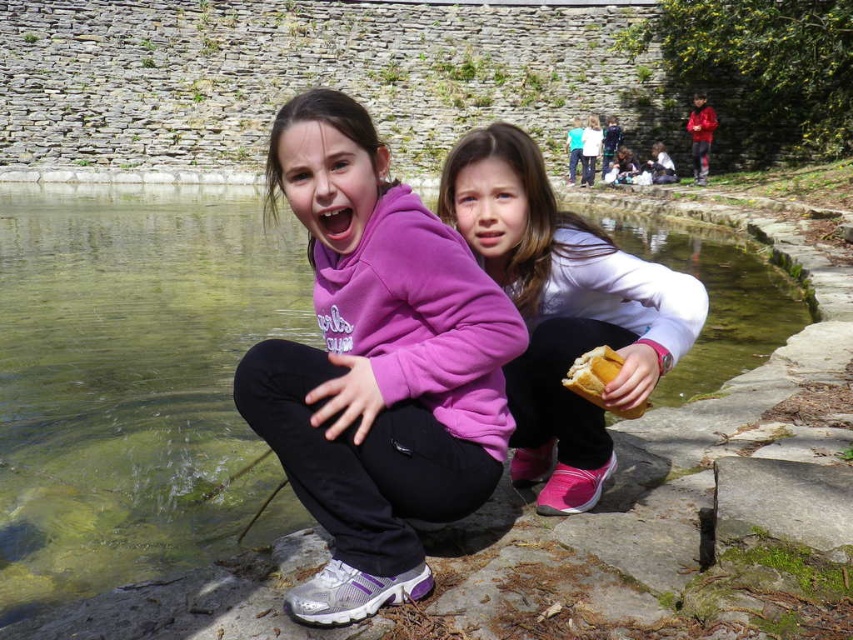
Between point (15, 573) and point (602, 378), which one is positioned behind?

Positioned behind is point (15, 573).

Is point (141, 212) positioned before point (606, 365)?

That is False.

Which is behind, point (183, 337) or point (614, 358)?

Positioned behind is point (183, 337).

This screenshot has width=853, height=640. I want to click on clear water at lake center, so click(131, 380).

Between clear water at lake center and white matte jacket at center, which one appears on the right side from the viewer's perspective?

white matte jacket at center is more to the right.

Image resolution: width=853 pixels, height=640 pixels. I want to click on clear water at lake center, so click(131, 380).

What are the coordinates of `clear water at lake center` in the screenshot? It's located at (131, 380).

Who is more forward, (515, 244) or (628, 416)?

Point (628, 416)

Can you confirm if white matte jacket at center is wider than golden bread at lower center?

Indeed, white matte jacket at center has a greater width compared to golden bread at lower center.

Is point (608, 305) positioned in front of point (601, 403)?

No, it is not.

This screenshot has width=853, height=640. Identify the location of white matte jacket at center. (563, 310).